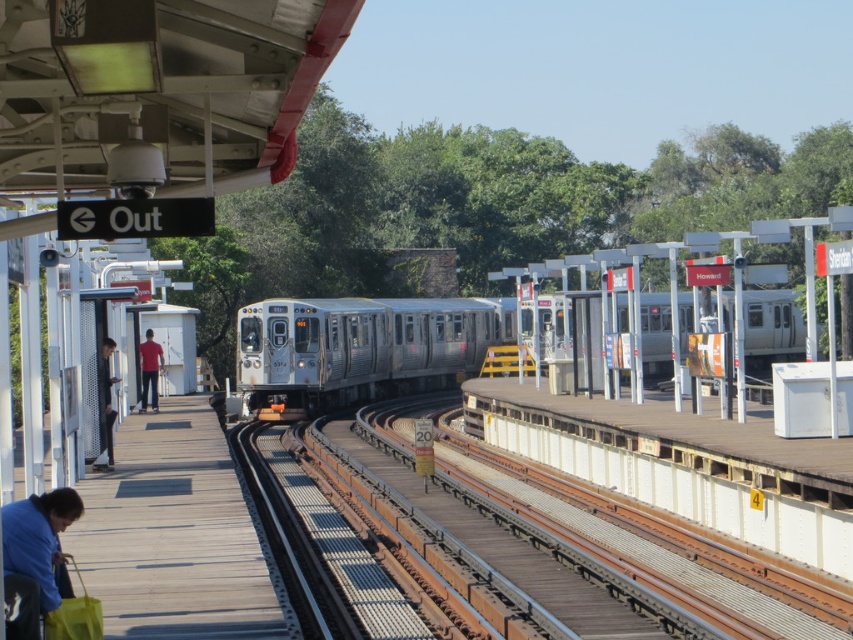
You are a passenger waiting at the train station and see the wooden platform at lower left and the blue fabric bag at lower left. Which object is closer to the ground?

The wooden platform at lower left is closer to the ground because it is below the blue fabric bag at lower left.

You are standing on the train station platform and see the blue fabric bag at lower left. If you want to pick it up, where exactly should you walk to?

You should walk to point (35, 557) to pick up the blue fabric bag at lower left.